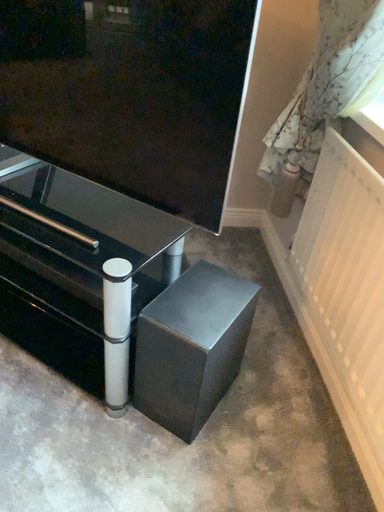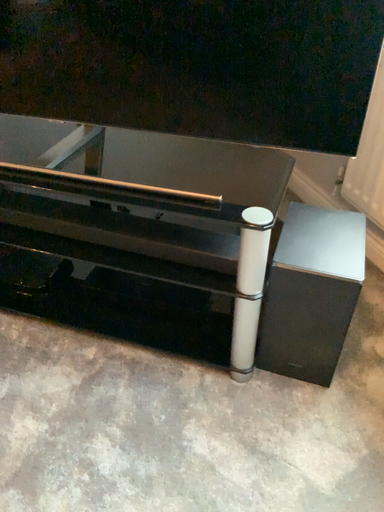
Question: How did the camera likely rotate when shooting the video?

Choices:
 (A) rotated right
 (B) rotated left

Answer: (A)